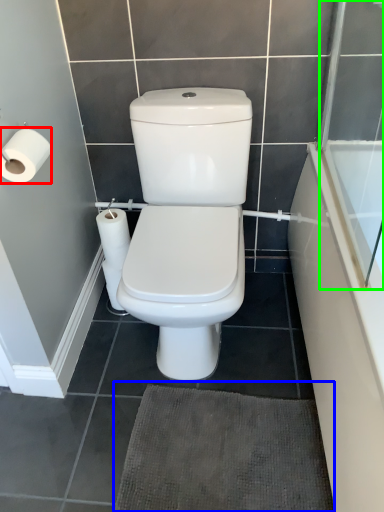
Question: Estimate the real-world distances between objects in this image. Which object is farther from toilet paper (highlighted by a red box), bath mat (highlighted by a blue box) or screen door (highlighted by a green box)?

Choices:
 (A) bath mat
 (B) screen door

Answer: (B)